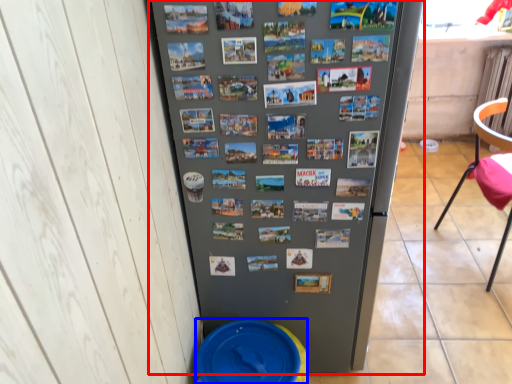
Question: Among these objects, which one is farthest to the camera, refrigerator (highlighted by a red box) or potty (highlighted by a blue box)?

Choices:
 (A) refrigerator
 (B) potty

Answer: (B)